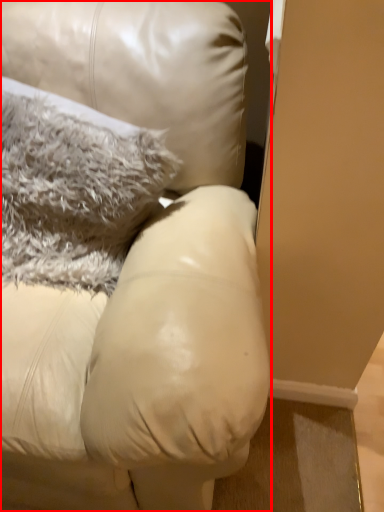
Question: From the image, what is the correct spatial relationship of furniture (annotated by the red box) in relation to pillow?

Choices:
 (A) left
 (B) right

Answer: (A)